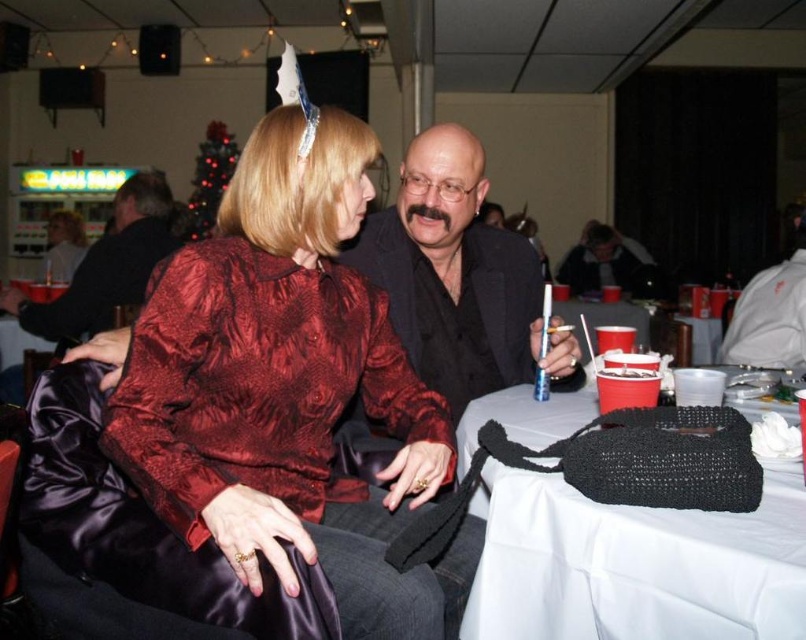
Question: Which object is positioned farthest from the matte black jacket at center?

Choices:
 (A) black knitted bag at lower right
 (B) matte black jacket at upper center
 (C) dark gray sweater at center

Answer: (C)

Question: Does shiny red blouse at center appear on the right side of dark gray sweater at center?

Choices:
 (A) yes
 (B) no

Answer: (B)

Question: Considering the relative positions of shiny red blouse at center and matte black jacket at upper center in the image provided, where is shiny red blouse at center located with respect to matte black jacket at upper center?

Choices:
 (A) left
 (B) right

Answer: (B)

Question: Is matte black jacket at upper center positioned behind dark gray sweater at center?

Choices:
 (A) no
 (B) yes

Answer: (A)

Question: Which point is farther to the camera?

Choices:
 (A) (106, 324)
 (B) (492, 524)
 (C) (293, 458)
 (D) (618, 250)

Answer: (D)

Question: Which object is positioned closest to the matte black jacket at upper center?

Choices:
 (A) dark gray sweater at center
 (B) black knitted bag at lower right
 (C) shiny red blouse at center

Answer: (C)